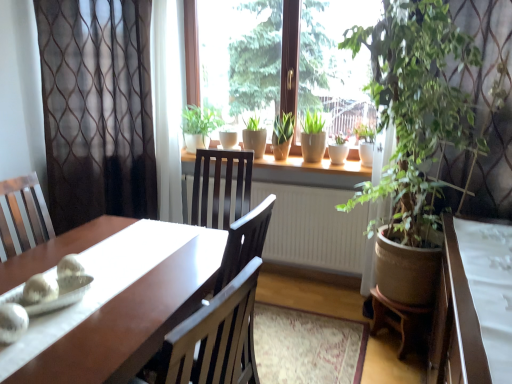
Question: In terms of width, does green leafy plant at right, which is the 1th houseplant from right to left, look wider or thinner when compared to green matte plant at center, the first houseplant in the left-to-right sequence?

Choices:
 (A) wide
 (B) thin

Answer: (A)

Question: In terms of size, does green leafy plant at right, which is the 5th houseplant in left-to-right order, appear bigger or smaller than green matte plant at center, the fifth houseplant in the right-to-left sequence?

Choices:
 (A) big
 (B) small

Answer: (A)

Question: Estimate the real-world distances between objects in this image. Which object is farther from the green matte plant at window, which ranks as the second houseplant in left-to-right order?

Choices:
 (A) sheer brown curtain at upper left, positioned as the second curtain in left-to-right order
 (B) shiny brown desk at left
 (C) white textured radiator at center
 (D) green leafy plant at right, which is the 1th houseplant from right to left
 (E) smooth wooden window sill at center

Answer: (B)

Question: Which object is positioned farthest from the sheer brown curtain at left, the second curtain from the right?

Choices:
 (A) smooth wooden window sill at center
 (B) shiny brown desk at left
 (C) white glossy table at lower right
 (D) green matte plant at window, which ranks as the second houseplant in left-to-right order
 (E) sheer brown curtain at upper left, which appears as the first curtain when viewed from the right

Answer: (C)